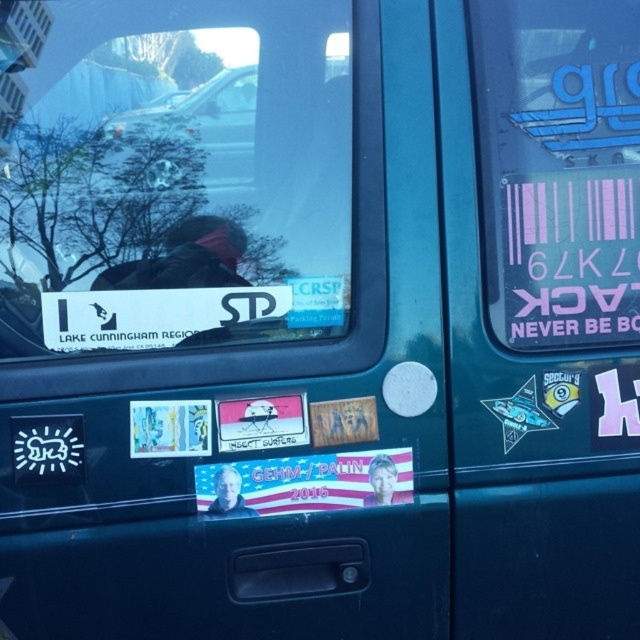
Question: Is pink matte sticker at upper right to the left of metallic silver car at upper center from the viewer's perspective?

Choices:
 (A) no
 (B) yes

Answer: (A)

Question: Does transparent glass window at upper center appear on the left side of pink matte sticker at upper right?

Choices:
 (A) no
 (B) yes

Answer: (B)

Question: Estimate the real-world distances between objects in this image. Which object is farther from the metallic silver car at upper center?

Choices:
 (A) transparent glass window at upper center
 (B) pink matte sticker at upper right

Answer: (B)

Question: Which object is positioned farthest from the transparent glass window at upper center?

Choices:
 (A) pink matte sticker at upper right
 (B) metallic silver car at upper center

Answer: (A)

Question: Estimate the real-world distances between objects in this image. Which object is farther from the pink matte sticker at upper right?

Choices:
 (A) metallic silver car at upper center
 (B) transparent glass window at upper center

Answer: (A)

Question: Is transparent glass window at upper center wider than pink matte sticker at upper right?

Choices:
 (A) yes
 (B) no

Answer: (A)